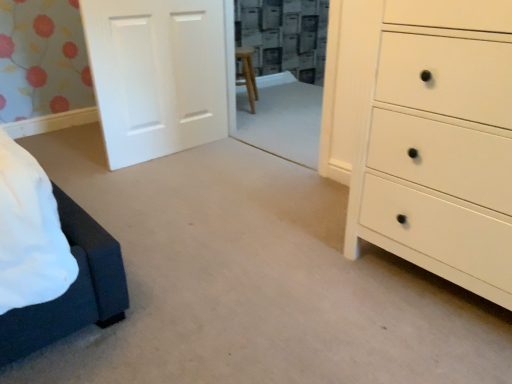
Identify the location of vacant region to the left of white matte chest of drawers at right. (296, 266).